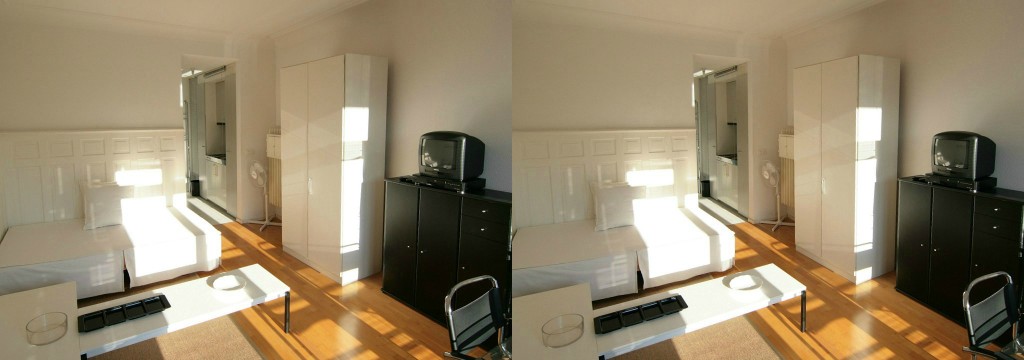
Where is `bowl`? bowl is located at coordinates (553, 328), (50, 324).